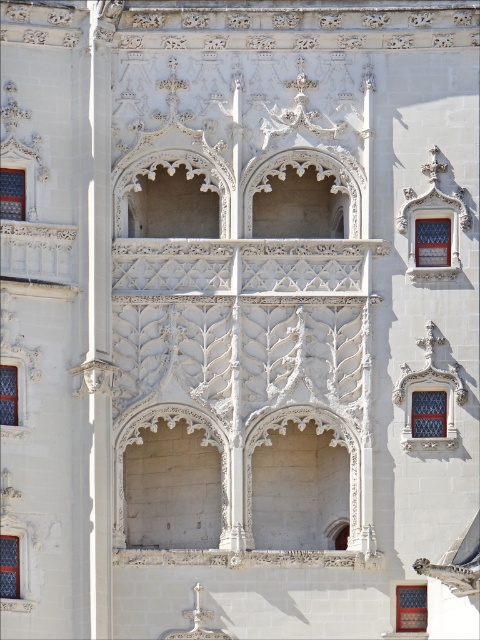
You are an architect analyzing the Gothic building facade. You notice a point labeled as point (12, 193). Based on the description, can you identify which architectural element this point corresponds to?

The point (12, 193) corresponds to the matte glass window at upper left.

You are an architect planning to install a new decorative banner between the two matte glass windows. The banner requires a minimum of 12 meters of space between the windows to be properly displayed. Based on the scene, will the distance between the matte glass window at center right and the matte glass window at center left accommodate the banner?

A: The matte glass window at center right and the matte glass window at center left are 13.34 meters apart, which exceeds the required 12 meters. Therefore, the banner can be installed between them.

You are an architect designing a replica of this Gothic facade. You need to ensure that the matte glass window at center right and the matte glass window at center left are proportionally accurate. Which of these two windows should have a wider design?

The matte glass window at center right should have a wider design since its width is larger than the matte glass window at center left according to the description.